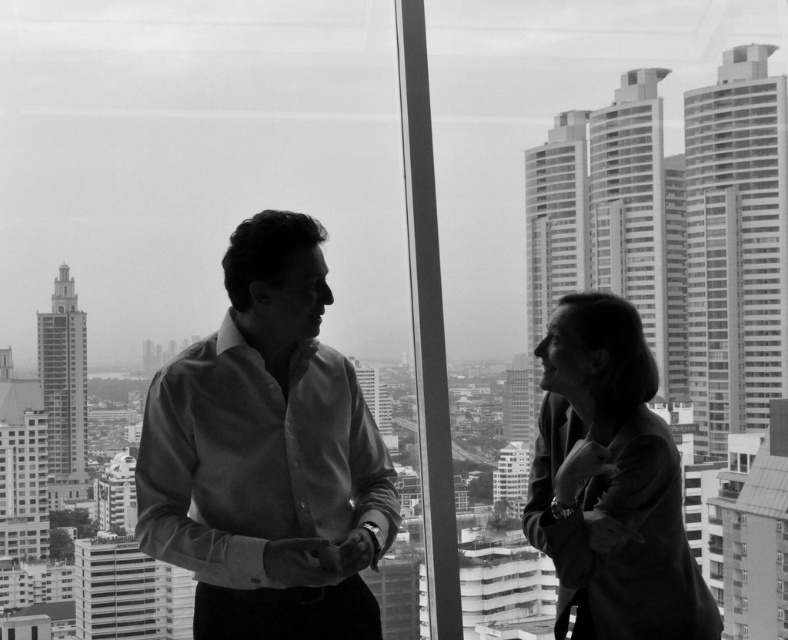
Does smooth shirt at center have a lesser height compared to smooth black blazer at right?

No, smooth shirt at center is not shorter than smooth black blazer at right.

The height and width of the screenshot is (640, 788). What do you see at coordinates (266, 456) in the screenshot?
I see `smooth shirt at center` at bounding box center [266, 456].

This screenshot has height=640, width=788. In order to click on smooth shirt at center in this screenshot , I will do `click(266, 456)`.

Can you confirm if matte white shirt at center is shorter than smooth black blazer at right?

In fact, matte white shirt at center may be taller than smooth black blazer at right.

Image resolution: width=788 pixels, height=640 pixels. What do you see at coordinates (266, 456) in the screenshot?
I see `matte white shirt at center` at bounding box center [266, 456].

You are a GUI agent. You are given a task and a screenshot of the screen. Output one action in this format:
    pyautogui.click(x=<x>, y=<y>)
    Task: Click on the matte white shirt at center
    The width and height of the screenshot is (788, 640).
    Given the screenshot: What is the action you would take?
    tap(266, 456)

Locate an element on the screen. matte white shirt at center is located at coordinates (266, 456).

Does smooth shirt at center have a greater width compared to matte white shirt at center?

Indeed, smooth shirt at center has a greater width compared to matte white shirt at center.

Image resolution: width=788 pixels, height=640 pixels. In order to click on smooth shirt at center in this screenshot , I will do click(x=266, y=456).